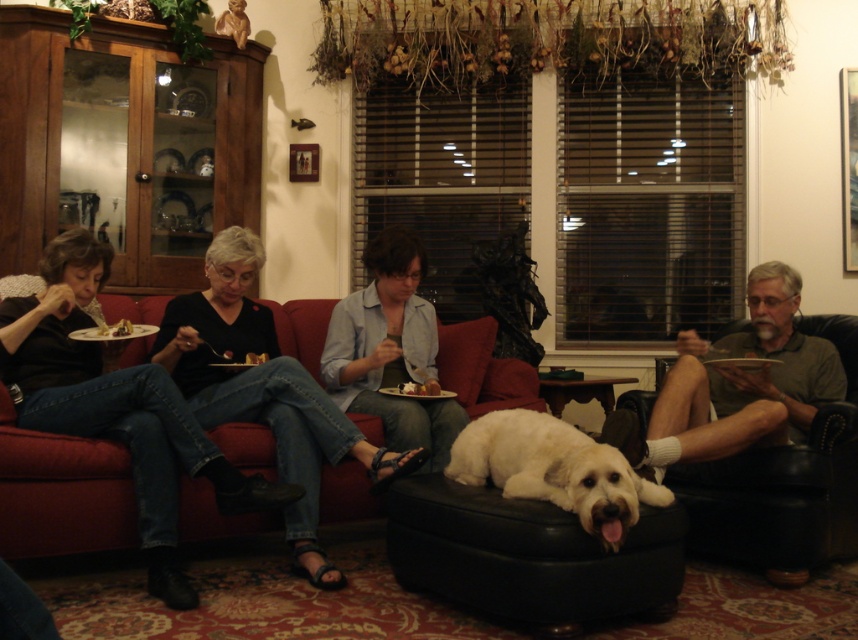
Where is the black cotton shirt at left located in the image?

The black cotton shirt at left is located at point (116, 406) in the image.

You are standing in the living room and want to place a small plant between the two points marked as point (x=156, y=488) and point (x=412, y=394). Which point should the plant be closer to in order to be positioned exactly halfway between them?

The plant should be placed closer to point (x=412, y=394) because point (x=156, y=488) is closer to the viewer, so the halfway point would require the plant to be nearer to the farther point to balance the distance.

You are standing at the origin point in the living room and see two points marked in the image. Which point is closer to you, point (482,397) or point (347,376)?

Point (347,376) is closer to you because it is in front of point (482,397).